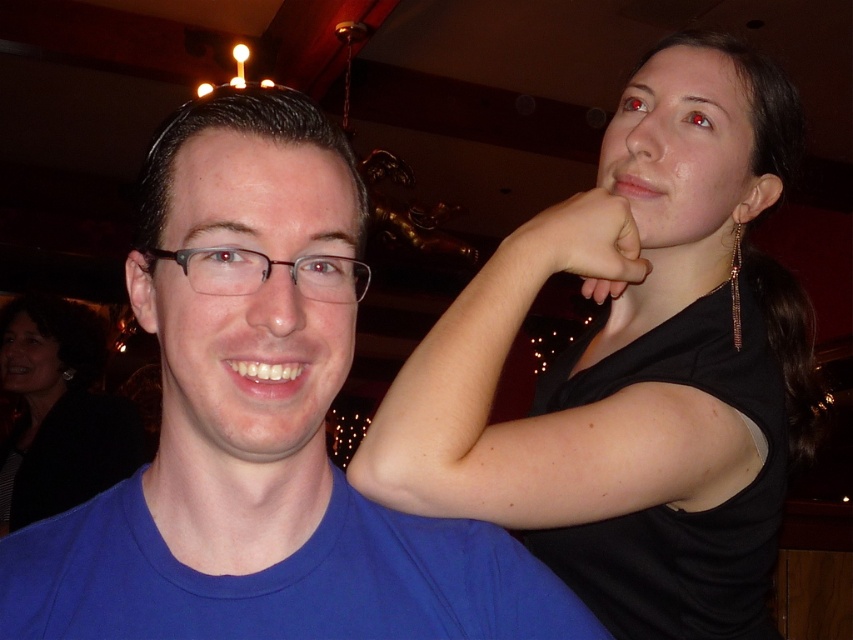
Question: Which point is closer to the camera?

Choices:
 (A) (155, 518)
 (B) (538, 228)

Answer: (A)

Question: Can you confirm if black matte shirt at upper right is positioned below brown plastic glasses at center?

Choices:
 (A) no
 (B) yes

Answer: (B)

Question: Which object appears closest to the camera in this image?

Choices:
 (A) blue matte shirt at center
 (B) matte skin hand at upper right

Answer: (A)

Question: Is black fabric at upper left above matte skin hand at upper right?

Choices:
 (A) yes
 (B) no

Answer: (B)

Question: Among these points, which one is farthest from the camera?

Choices:
 (A) pos(68,596)
 (B) pos(293,264)
 (C) pos(20,355)

Answer: (C)

Question: Can you confirm if black matte shirt at upper right is wider than black fabric at upper left?

Choices:
 (A) yes
 (B) no

Answer: (B)